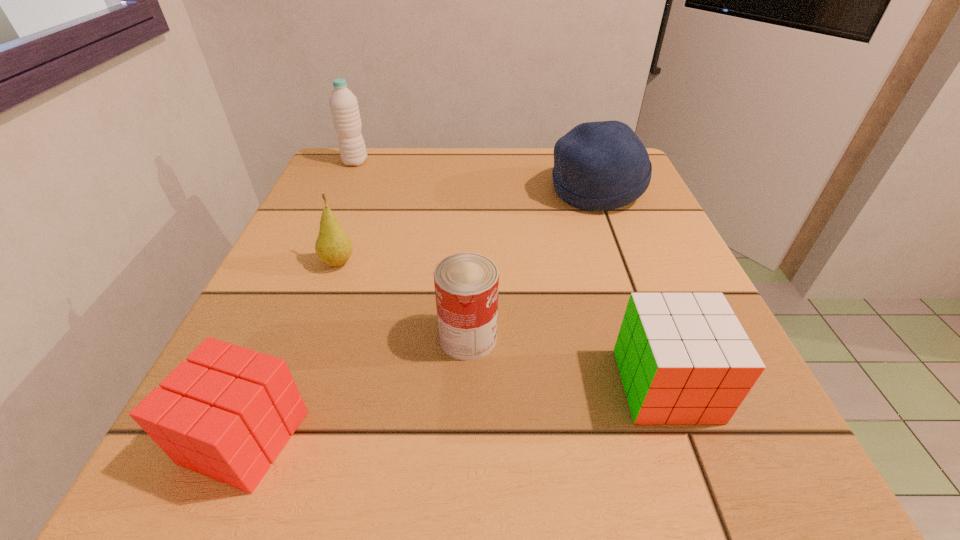
In order to click on free space that is in between the fifth shortest object and the left cube in this screenshot , I will do point(420,314).

This screenshot has width=960, height=540. In order to click on object that is the fourth closest to the pear in this screenshot , I will do `click(598, 166)`.

Identify which object is located as the fifth nearest to the left cube. Please provide its 2D coordinates. Your answer should be formatted as a tuple, i.e. [(x, y)], where the tuple contains the x and y coordinates of a point satisfying the conditions above.

[(344, 107)]

You are a GUI agent. You are given a task and a screenshot of the screen. Output one action in this format:
    pyautogui.click(x=<x>, y=<y>)
    Task: Click on the free space that satisfies the following two spatial constraints: 1. on the front label of the third object from right to left; 2. on the left side of the right cube
    The width and height of the screenshot is (960, 540).
    Given the screenshot: What is the action you would take?
    pyautogui.click(x=467, y=385)

Find the location of `vacant space that satisfies the following two spatial constraints: 1. on the front label of the can; 2. on the right side of the right cube`. vacant space that satisfies the following two spatial constraints: 1. on the front label of the can; 2. on the right side of the right cube is located at coordinates (467, 385).